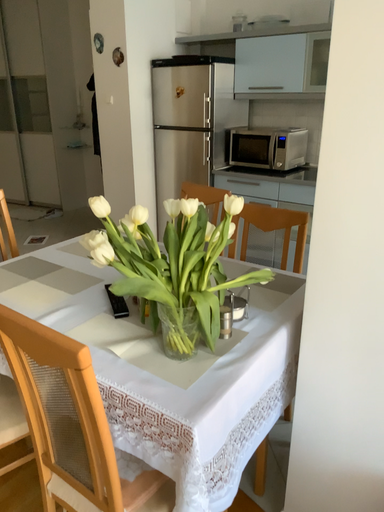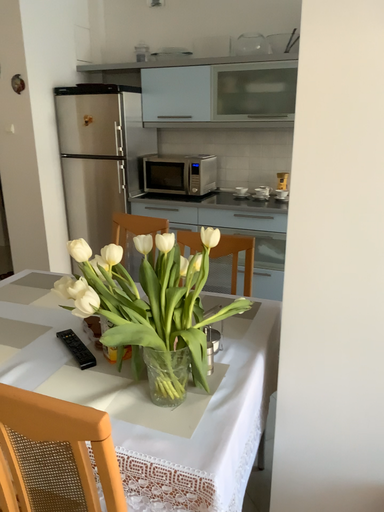
Question: How did the camera likely rotate when shooting the video?

Choices:
 (A) rotated left
 (B) rotated right

Answer: (B)